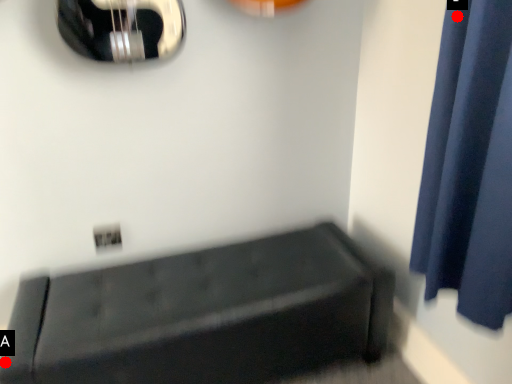
Question: Two points are circled on the image, labeled by A and B beside each circle. Which point is closer to the camera?

Choices:
 (A) A is closer
 (B) B is closer

Answer: (B)